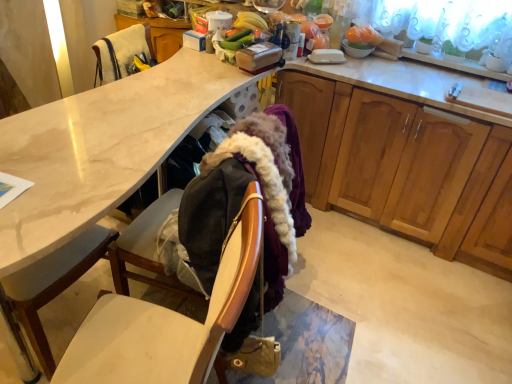
What are the coordinates of `unoccupied region to the right of white glossy bowl at upper right` in the screenshot? It's located at (391, 64).